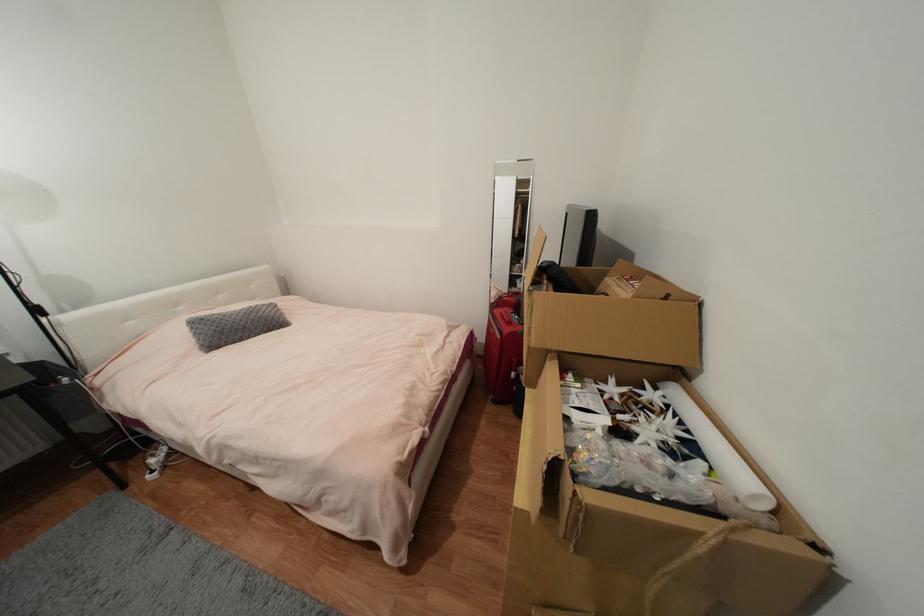
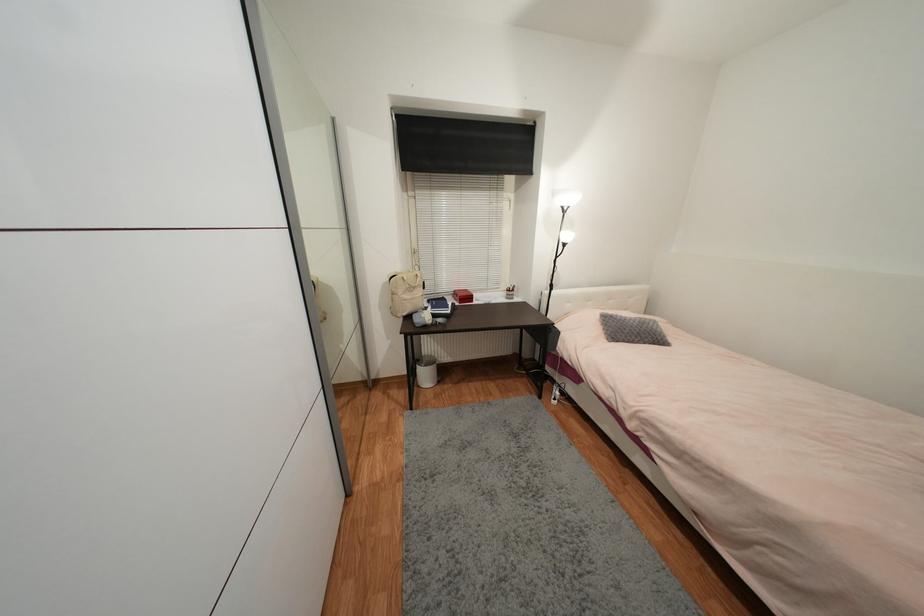
Question: The first image is from the beginning of the video and the second image is from the end. How did the camera likely rotate when shooting the video?

Choices:
 (A) Left
 (B) Right
 (C) Up
 (D) Down

Answer: (A)